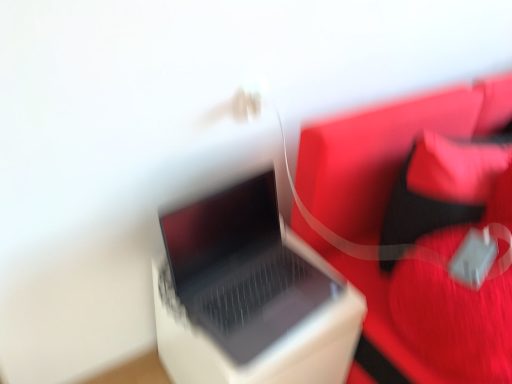
You are a GUI agent. You are given a task and a screenshot of the screen. Output one action in this format:
    pyautogui.click(x=<x>, y=<y>)
    Task: Click on the blank space above white plastic laptop at center (from a real-world perspective)
    Image resolution: width=512 pixels, height=384 pixels.
    Given the screenshot: What is the action you would take?
    pyautogui.click(x=263, y=287)